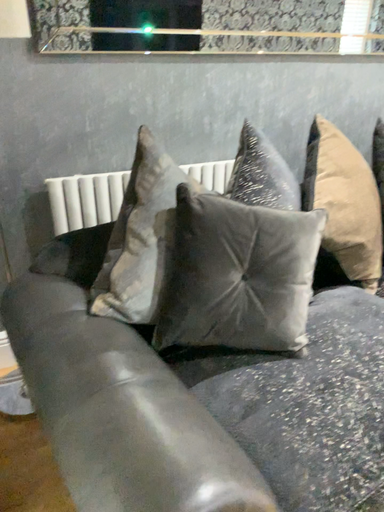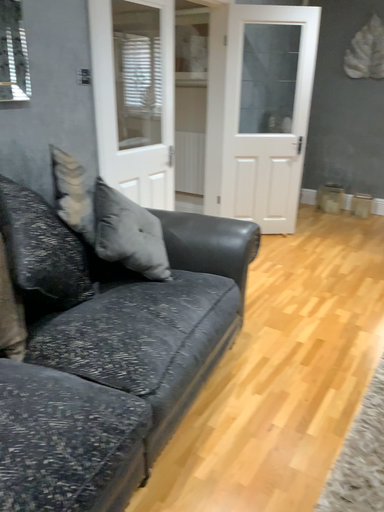
Question: Which way did the camera rotate in the video?

Choices:
 (A) rotated right
 (B) rotated left

Answer: (A)